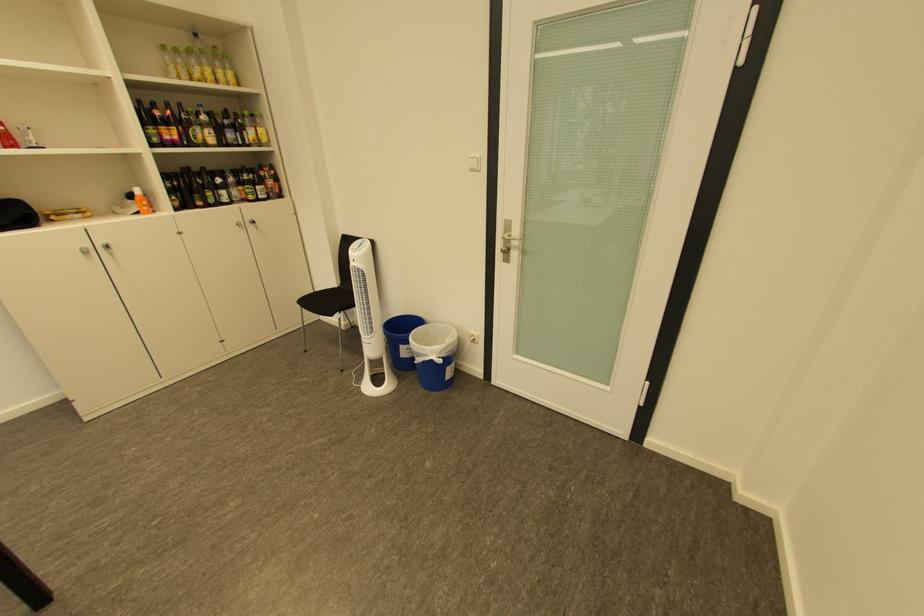
What are the coordinates of `orange spray bottle` in the screenshot? It's located at (141, 201).